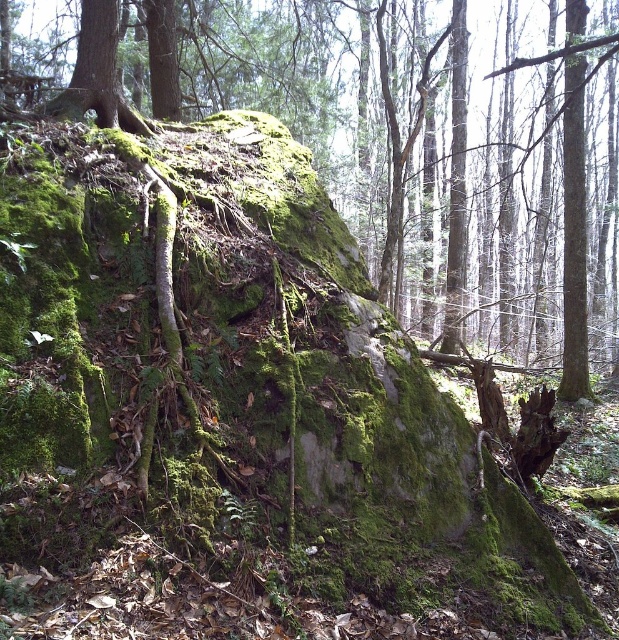
Question: Which point is closer to the camera taking this photo?

Choices:
 (A) (576, 90)
 (B) (563, 252)

Answer: (A)

Question: Which point is closer to the camera?

Choices:
 (A) (409, 44)
 (B) (586, 387)

Answer: (B)

Question: Does green mossy rock at center lie behind green mossy rock at upper right?

Choices:
 (A) no
 (B) yes

Answer: (A)

Question: Among these points, which one is farthest from the camera?

Choices:
 (A) (530, 24)
 (B) (582, 275)

Answer: (A)

Question: Does green mossy rock at center have a lesser width compared to green mossy rock at upper right?

Choices:
 (A) no
 (B) yes

Answer: (A)

Question: Considering the relative positions of green mossy rock at center and green mossy rock at upper right in the image provided, where is green mossy rock at center located with respect to green mossy rock at upper right?

Choices:
 (A) below
 (B) above

Answer: (B)